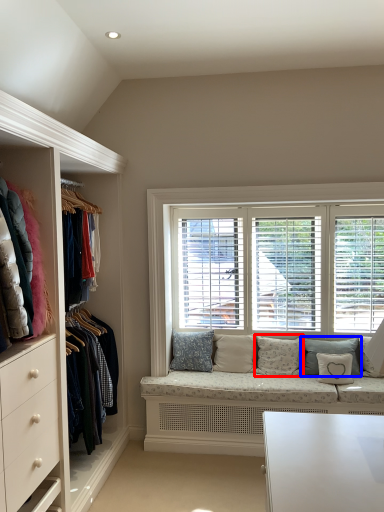
Question: Which point is closer to the camera, pillow (highlighted by a red box) or pillow (highlighted by a blue box)?

Choices:
 (A) pillow
 (B) pillow

Answer: (B)